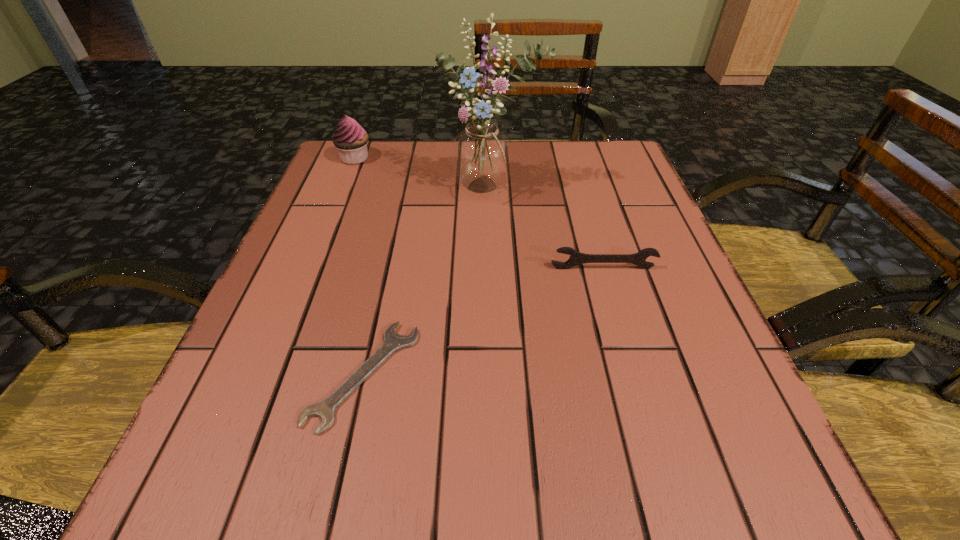
Image resolution: width=960 pixels, height=540 pixels. Find the location of `vacant region at the left edge of the desktop`. vacant region at the left edge of the desktop is located at coordinates (300, 340).

The width and height of the screenshot is (960, 540). Find the location of `vacant space at the right edge of the desktop`. vacant space at the right edge of the desktop is located at coordinates (582, 196).

Where is `vacant space at the far right corner of the desktop`? vacant space at the far right corner of the desktop is located at coordinates (589, 176).

I want to click on vacant area that lies between the left wrench and the cupcake, so click(x=359, y=266).

This screenshot has height=540, width=960. What are the coordinates of `unoccupied position between the tallest object and the farther wrench` in the screenshot? It's located at (547, 230).

Find the location of a particular element. The image size is (960, 540). vacant space in between the third shortest object and the shortest object is located at coordinates tap(359, 266).

The image size is (960, 540). Identify the location of blank region between the taller wrench and the leftmost object. (479, 213).

You are a GUI agent. You are given a task and a screenshot of the screen. Output one action in this format:
    pyautogui.click(x=<x>, y=<y>)
    Task: Click on the vacant area between the taller wrench and the bouquet
    The width and height of the screenshot is (960, 540).
    Given the screenshot: What is the action you would take?
    pyautogui.click(x=547, y=230)

I want to click on vacant area that lies between the shortest object and the third tallest object, so click(484, 321).

At what (x,y) coordinates should I click in order to perform the action: click on free space between the second shortest object and the cupcake. Please return your answer as a coordinate pair (x, y). The height and width of the screenshot is (540, 960). Looking at the image, I should click on (479, 213).